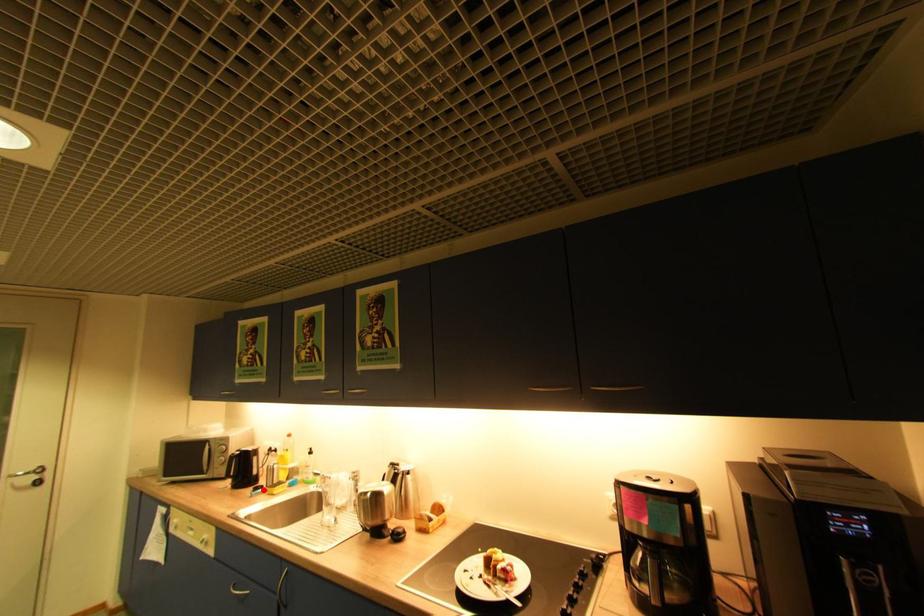
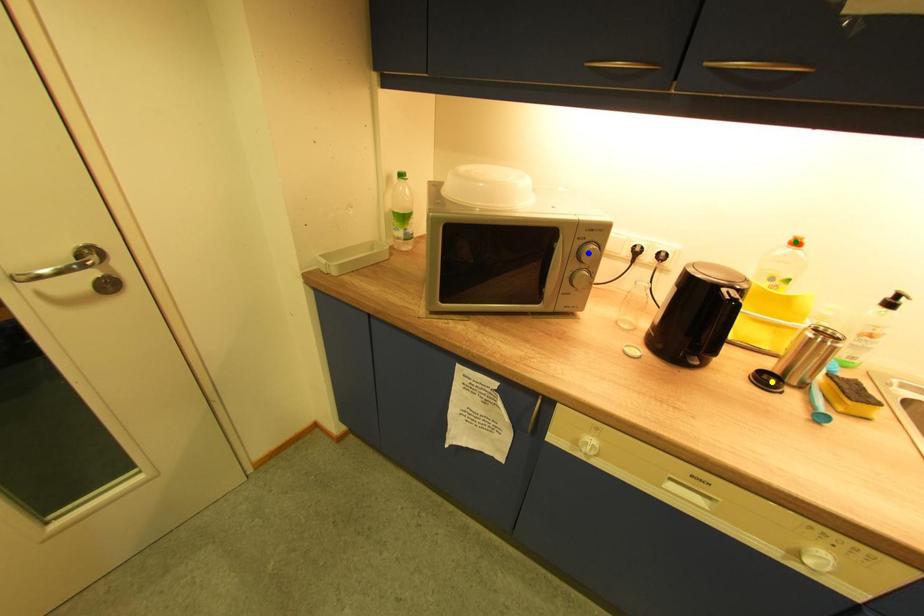
Question: I am providing you with two images of the same scene from different viewpoints. A red point is marked on the first image. You are given multiple points on the second image. In image 2, which mark is for the same physical point as the one in image 1?

Choices:
 (A) yellow point
 (B) green point
 (C) blue point

Answer: (A)